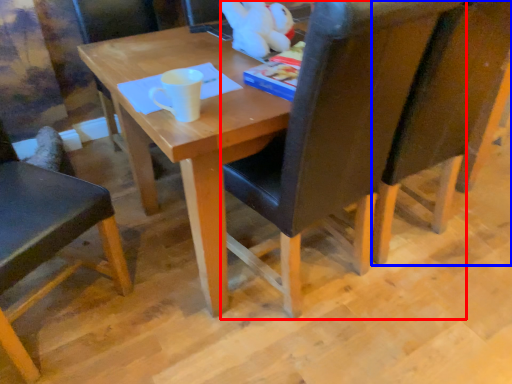
Question: Which object is further to the camera taking this photo, chair (highlighted by a red box) or chair (highlighted by a blue box)?

Choices:
 (A) chair
 (B) chair

Answer: (B)